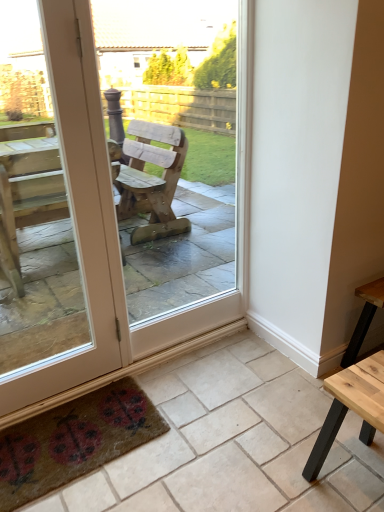
Locate an element on the screen. free spot below light brown wooden table at lower right (from a real-world perspective) is located at coordinates (359, 477).